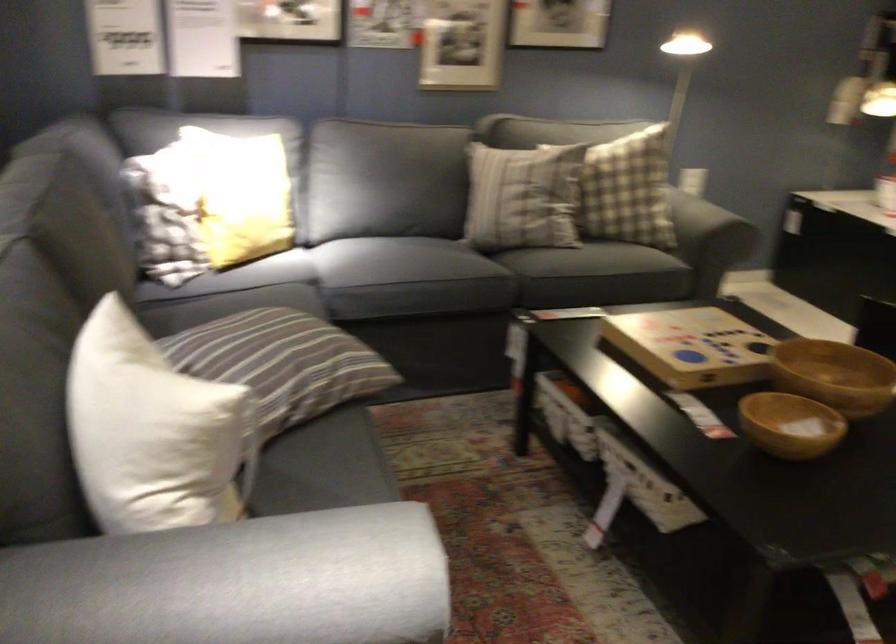
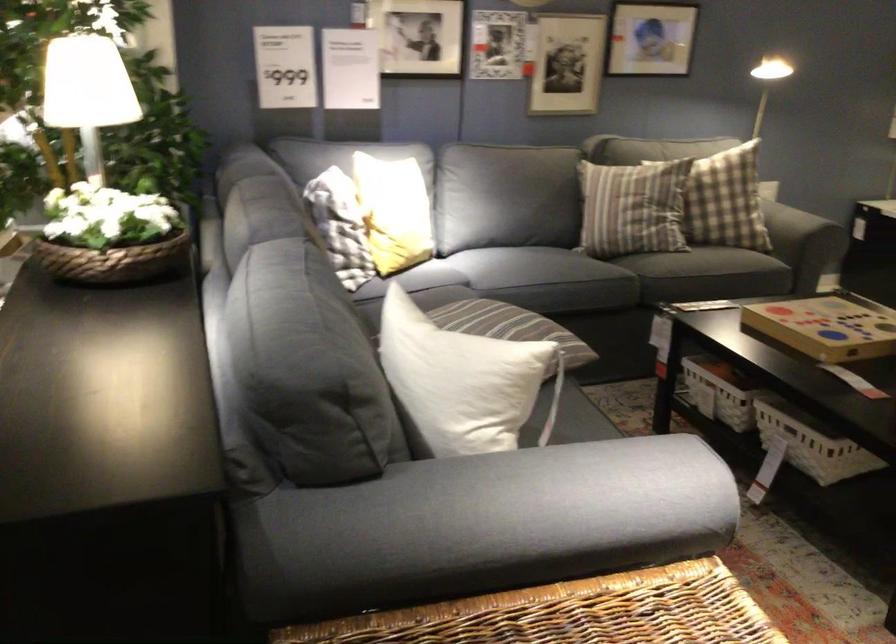
Locate, in the second image, the point that corresponds to (675,231) in the first image.

(798, 223)